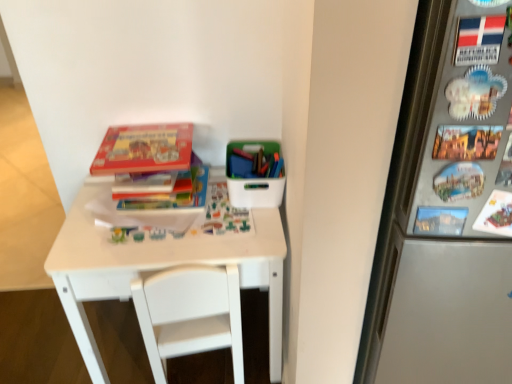
Question: Is hardcover book at center, the second book when ordered from top to bottom, beside matte cardboard book at upper left, the 1th book viewed from the top?

Choices:
 (A) yes
 (B) no

Answer: (B)

Question: From the image's perspective, is hardcover book at center, which ranks as the first book in bottom-to-top order, located beneath matte cardboard book at upper left, acting as the second book starting from the bottom?

Choices:
 (A) no
 (B) yes

Answer: (B)

Question: Is hardcover book at center, the second book when ordered from top to bottom, taller than matte cardboard book at upper left, the 1th book viewed from the top?

Choices:
 (A) yes
 (B) no

Answer: (A)

Question: Is hardcover book at center, the second book when ordered from top to bottom, smaller than matte cardboard book at upper left, acting as the second book starting from the bottom?

Choices:
 (A) yes
 (B) no

Answer: (B)

Question: Would you say hardcover book at center, the second book when ordered from top to bottom, contains matte cardboard book at upper left, the 1th book viewed from the top?

Choices:
 (A) no
 (B) yes

Answer: (A)

Question: Does hardcover book at center, which ranks as the first book in bottom-to-top order, have a larger size compared to matte cardboard book at upper left, acting as the second book starting from the bottom?

Choices:
 (A) yes
 (B) no

Answer: (A)

Question: Considering the relative sizes of white plastic chair at center and matte cardboard book at upper left, the 1th book viewed from the top, in the image provided, is white plastic chair at center wider than matte cardboard book at upper left, the 1th book viewed from the top,?

Choices:
 (A) yes
 (B) no

Answer: (A)

Question: Does white plastic chair at center come in front of matte cardboard book at upper left, acting as the second book starting from the bottom?

Choices:
 (A) no
 (B) yes

Answer: (B)

Question: Is white plastic chair at center with matte cardboard book at upper left, acting as the second book starting from the bottom?

Choices:
 (A) yes
 (B) no

Answer: (B)

Question: Is white plastic chair at center oriented towards matte cardboard book at upper left, acting as the second book starting from the bottom?

Choices:
 (A) no
 (B) yes

Answer: (A)

Question: From the image's perspective, is white plastic chair at center under matte cardboard book at upper left, the 1th book viewed from the top?

Choices:
 (A) no
 (B) yes

Answer: (B)

Question: Is white plastic chair at center oriented away from matte cardboard book at upper left, the 1th book viewed from the top?

Choices:
 (A) yes
 (B) no

Answer: (B)

Question: Is white matte table at center far from white plastic chair at center?

Choices:
 (A) yes
 (B) no

Answer: (B)